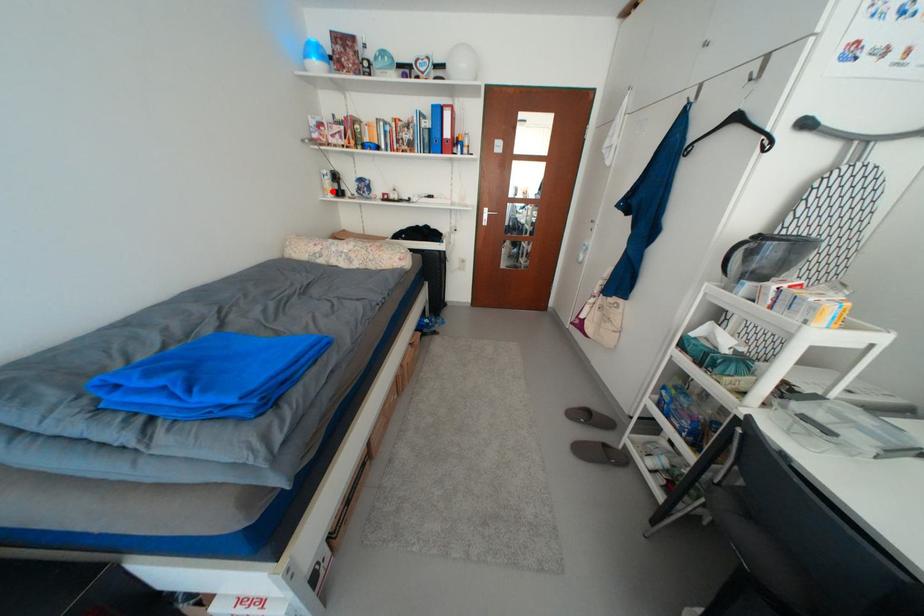
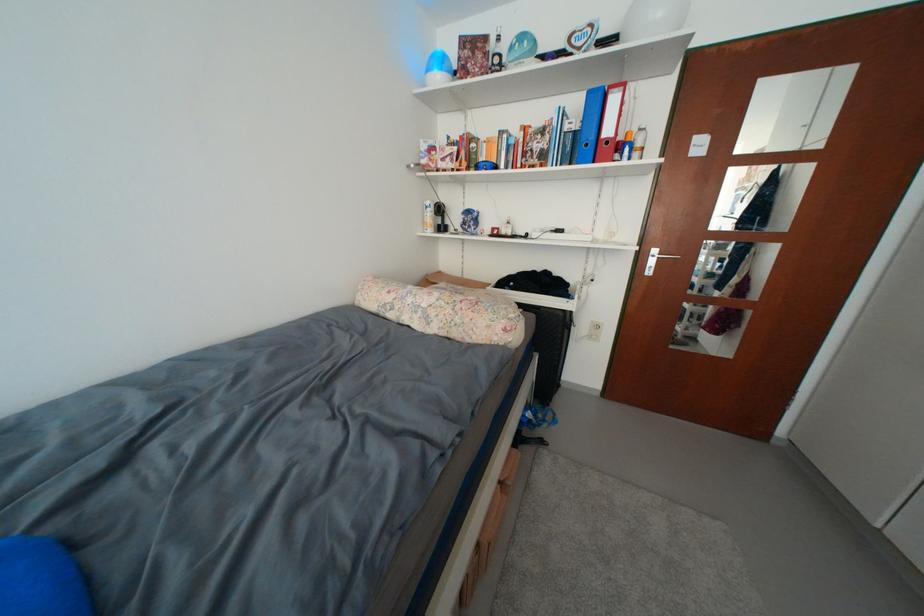
Question: I am providing you with two images of the same scene from different viewpoints. Image1 has a red point marked. In image2, the corresponding 3D location appears at what relative position? Reply with the corresponding letter.

Choices:
 (A) Closer
 (B) Farther

Answer: (B)